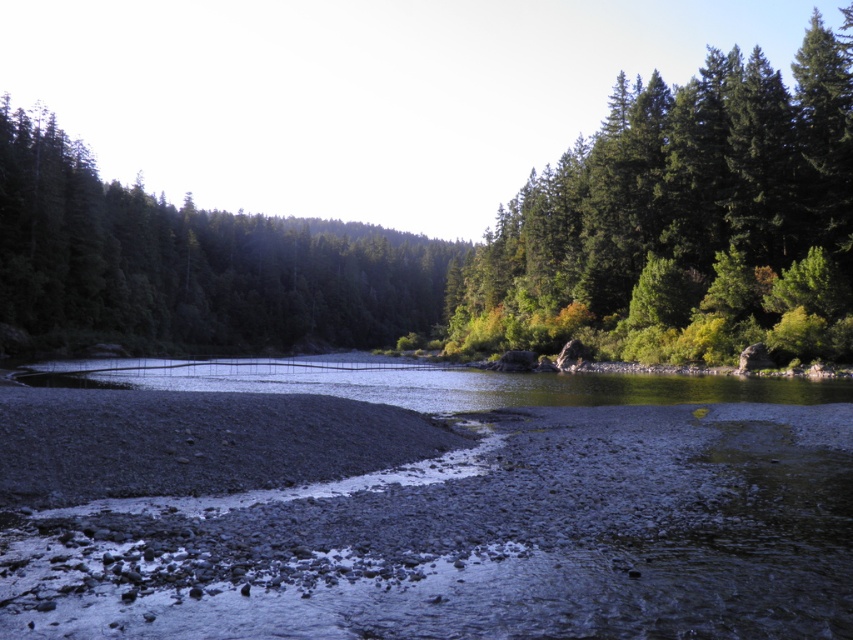
Can you confirm if green matte tree at upper right is positioned to the right of green matte tree at upper center?

Yes, green matte tree at upper right is to the right of green matte tree at upper center.

Can you confirm if green matte tree at upper right is wider than green matte tree at upper center?

Indeed, green matte tree at upper right has a greater width compared to green matte tree at upper center.

This screenshot has height=640, width=853. I want to click on green matte tree at upper right, so click(x=683, y=221).

Who is more distant from viewer, (651, 538) or (303, 340)?

Point (303, 340)

Can you confirm if gray gravel riverbed at center is positioned above green matte tree at upper center?

Actually, gray gravel riverbed at center is below green matte tree at upper center.

Where is `gray gravel riverbed at center`? The width and height of the screenshot is (853, 640). gray gravel riverbed at center is located at coordinates (421, 504).

The image size is (853, 640). What are the coordinates of `gray gravel riverbed at center` in the screenshot? It's located at [x=421, y=504].

Find the location of a particular element. Image resolution: width=853 pixels, height=640 pixels. gray gravel riverbed at center is located at coordinates (421, 504).

The height and width of the screenshot is (640, 853). Find the location of `gray gravel riverbed at center`. gray gravel riverbed at center is located at coordinates (421, 504).